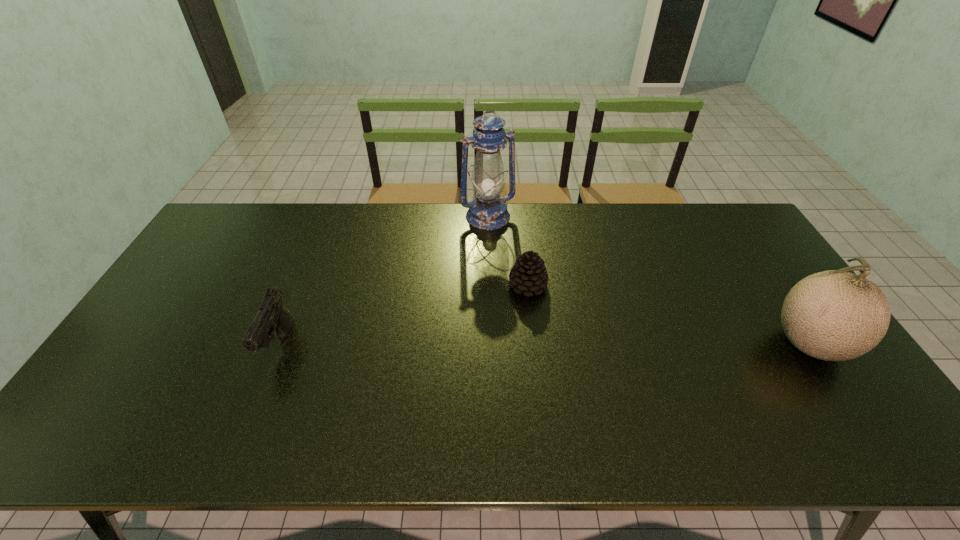
Identify the location of free space between the pistol and the lantern. (384, 280).

Locate an element on the screen. object that is the third closest to the pistol is located at coordinates (834, 315).

Find the location of a particular element. This screenshot has width=960, height=540. object that can be found as the closest to the leftmost object is located at coordinates (487, 211).